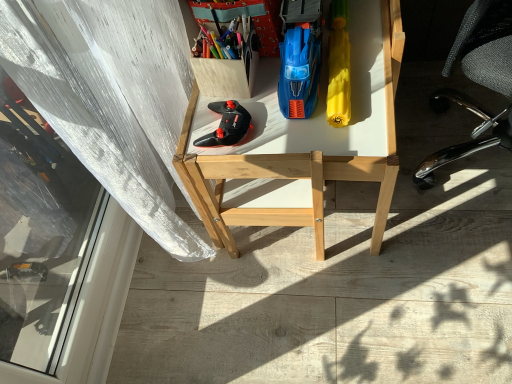
Where is `free space in front of blue plastic toy car at center, the 2th stationery from the right`? The width and height of the screenshot is (512, 384). free space in front of blue plastic toy car at center, the 2th stationery from the right is located at coordinates (331, 121).